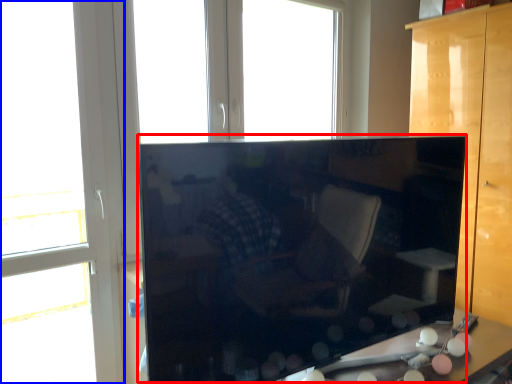
Question: Which of the following is the closest to the observer, cabinetry (highlighted by a red box) or window (highlighted by a blue box)?

Choices:
 (A) cabinetry
 (B) window

Answer: (A)